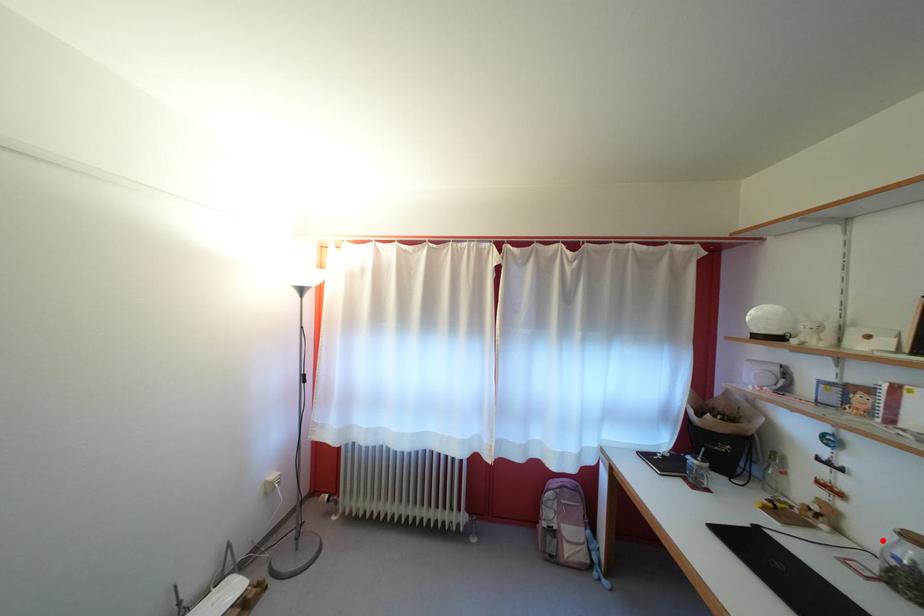
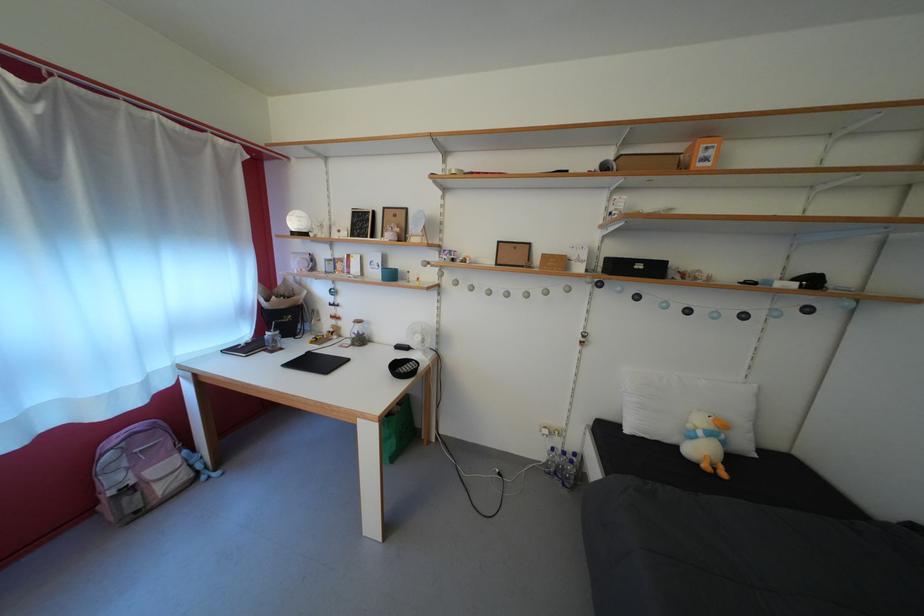
The point at the highlighted location is marked in the first image. Where is the corresponding point in the second image?

(358, 334)